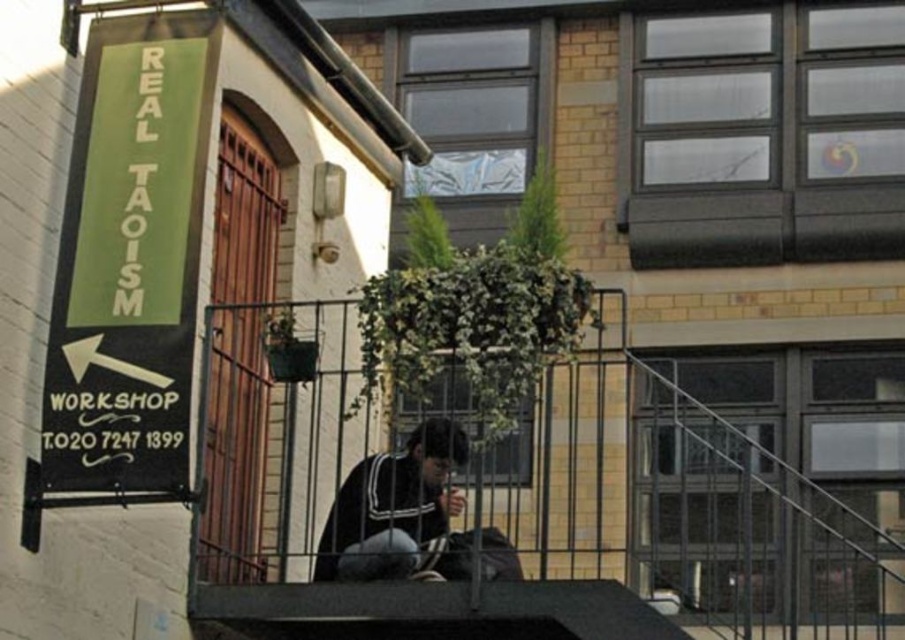
Which of these two, metallic gray balcony at center or dark blue fabric jacket at center, stands taller?

metallic gray balcony at center is taller.

Is point (349, 314) closer to camera compared to point (414, 444)?

No, it is behind (414, 444).

Which is behind, point (326, 522) or point (440, 536)?

Positioned behind is point (326, 522).

Where is `metallic gray balcony at center`? metallic gray balcony at center is located at coordinates (678, 506).

Is point (252, 337) farther from viewer compared to point (179, 17)?

That is True.

Based on the photo, is metallic gray balcony at center taller than green matte sign at upper left?

Correct, metallic gray balcony at center is much taller as green matte sign at upper left.

Identify the location of metallic gray balcony at center. (678, 506).

Where is `metallic gray balcony at center`? metallic gray balcony at center is located at coordinates (678, 506).

Is green matte sign at upper left thinner than dark blue fabric jacket at center?

Yes.

Which is behind, point (126, 353) or point (434, 467)?

Positioned behind is point (434, 467).

Does point (137, 243) lie in front of point (456, 496)?

Yes, point (137, 243) is in front of point (456, 496).

Find the location of a particular element. The width and height of the screenshot is (905, 640). green matte sign at upper left is located at coordinates [x=129, y=269].